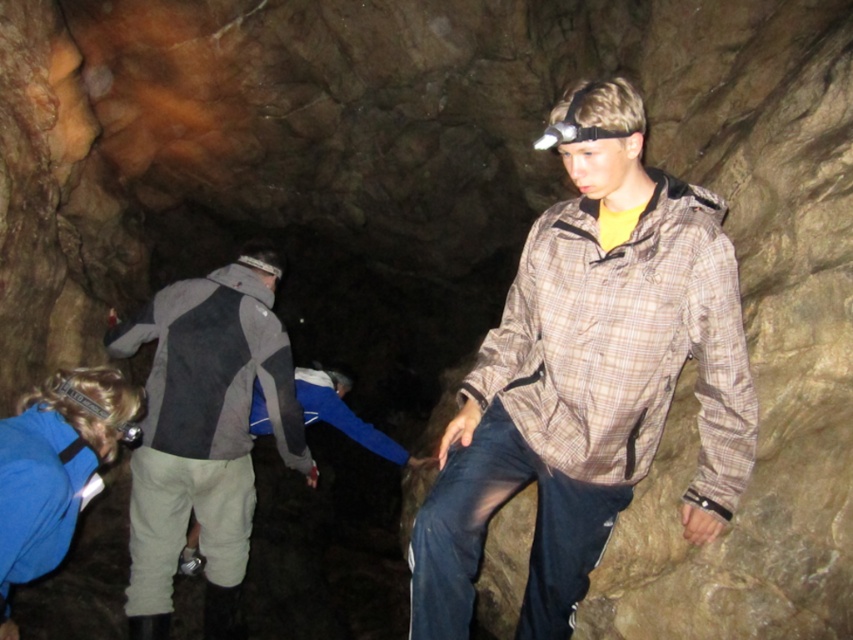
Question: Is brown plaid jacket at center to the right of gray/black fabric jacket at center from the viewer's perspective?

Choices:
 (A) no
 (B) yes

Answer: (B)

Question: Among these objects, which one is farthest from the camera?

Choices:
 (A) brown plaid jacket at center
 (B) gray/black fabric jacket at center

Answer: (B)

Question: Is brown plaid jacket at center bigger than gray/black fabric jacket at center?

Choices:
 (A) no
 (B) yes

Answer: (A)

Question: Which object appears farthest from the camera in this image?

Choices:
 (A) gray/black fabric jacket at center
 (B) brown plaid jacket at center

Answer: (A)

Question: Which point appears closest to the camera in this image?

Choices:
 (A) (643, 195)
 (B) (200, 426)

Answer: (A)

Question: Observing the image, what is the correct spatial positioning of brown plaid jacket at center in reference to gray/black fabric jacket at center?

Choices:
 (A) above
 (B) below

Answer: (A)